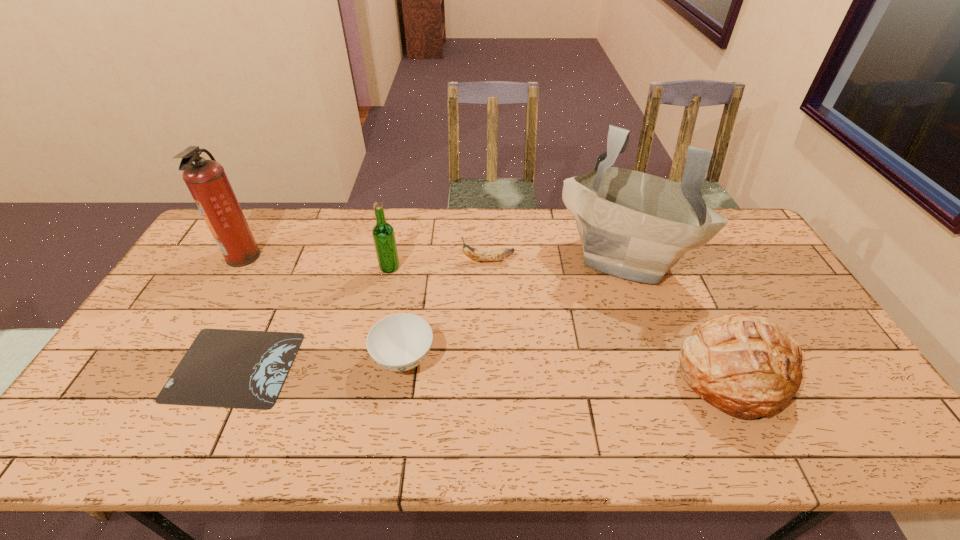
Locate an element on the screen. mousepad at the left edge is located at coordinates (244, 369).

Image resolution: width=960 pixels, height=540 pixels. Find the location of `object situated at the right edge`. object situated at the right edge is located at coordinates (740, 363).

Where is `object that is at the far left corner`? Image resolution: width=960 pixels, height=540 pixels. object that is at the far left corner is located at coordinates (206, 180).

The image size is (960, 540). I want to click on object that is at the near right corner, so click(740, 363).

This screenshot has height=540, width=960. In order to click on free spot at the far edge of the desktop in this screenshot , I will do `click(329, 210)`.

Locate an element on the screen. The height and width of the screenshot is (540, 960). free space at the near edge is located at coordinates (704, 442).

Identify the location of vacant position at the left edge of the desktop. (199, 303).

You are a GUI agent. You are given a task and a screenshot of the screen. Output one action in this format:
    pyautogui.click(x=<x>, y=<y>)
    Task: Click on the free spot at the right edge of the desktop
    The height and width of the screenshot is (540, 960).
    Given the screenshot: What is the action you would take?
    pyautogui.click(x=828, y=384)

You are a GUI agent. You are given a task and a screenshot of the screen. Output one action in this format:
    pyautogui.click(x=<x>, y=<y>)
    Task: Click on the free space at the far right corner of the desktop
    
    Given the screenshot: What is the action you would take?
    pyautogui.click(x=730, y=245)

In order to click on free space between the fire extinguisher and the shopping bag in this screenshot , I will do `click(435, 256)`.